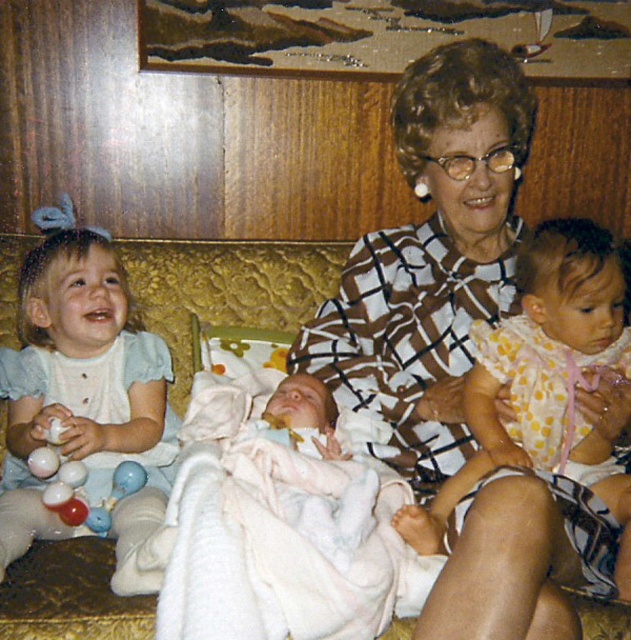
Question: Which of these objects is positioned closest to the gold textured couch at center?

Choices:
 (A) light blue fabric dress at left
 (B) yellow polka dot dress at center

Answer: (A)

Question: Is light blue fabric dress at left behind gold textured couch at center?

Choices:
 (A) no
 (B) yes

Answer: (A)

Question: Based on their relative distances, which object is farther from the yellow polka dot dress at center?

Choices:
 (A) light blue fabric dress at left
 (B) gold textured couch at center

Answer: (A)

Question: Is light blue fabric dress at left in front of yellow polka dot dress at center?

Choices:
 (A) no
 (B) yes

Answer: (A)

Question: Which of the following is the closest to the observer?

Choices:
 (A) gold textured couch at center
 (B) yellow polka dot dress at center

Answer: (B)

Question: Is yellow polka dot dress at center thinner than gold textured couch at center?

Choices:
 (A) no
 (B) yes

Answer: (B)